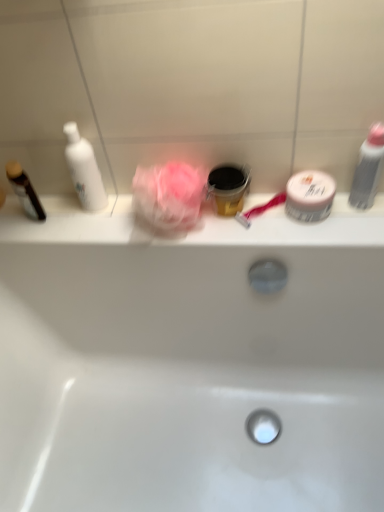
Question: Based on their sizes in the image, would you say black plastic cup at center, arranged as the third toiletry when viewed from the right, is bigger or smaller than white matte jar at right, which appears as the second toiletry when viewed from the right?

Choices:
 (A) big
 (B) small

Answer: (A)

Question: From the image's perspective, relative to white matte jar at right, placed as the third toiletry when sorted from left to right, is black plastic cup at center, arranged as the third toiletry when viewed from the right, above or below?

Choices:
 (A) above
 (B) below

Answer: (A)

Question: Which of these objects is positioned farthest from the white glossy bathtub at center?

Choices:
 (A) white glossy bottle at left
 (B) white matte jar at right, which appears as the second toiletry when viewed from the right
 (C) pink fabric rose at center
 (D) black plastic cup at center, which is counted as the second toiletry, starting from the left
 (E) dark brown glossy bottle at left, which appears as the 4th toiletry when viewed from the right

Answer: (E)

Question: Considering the real-world distances, which object is farthest from the white matte jar at right, which appears as the second toiletry when viewed from the right?

Choices:
 (A) pink fabric rose at center
 (B) dark brown glossy bottle at left, which appears as the 4th toiletry when viewed from the right
 (C) white glossy bottle at left
 (D) gray matte bottle at right, the 1th toiletry in the right-to-left sequence
 (E) white glossy bathtub at center

Answer: (B)